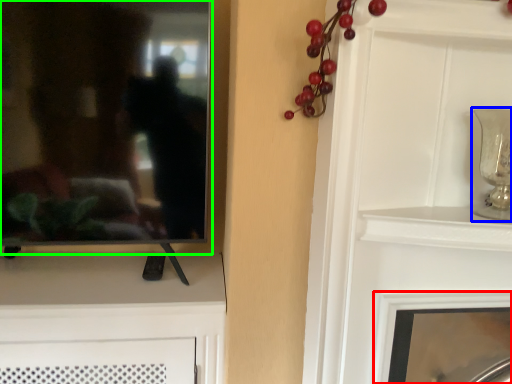
Question: Which object is positioned closest to fireplace (highlighted by a red box)? Select from candle holder (highlighted by a blue box) and mirror (highlighted by a green box).

Choices:
 (A) candle holder
 (B) mirror

Answer: (A)